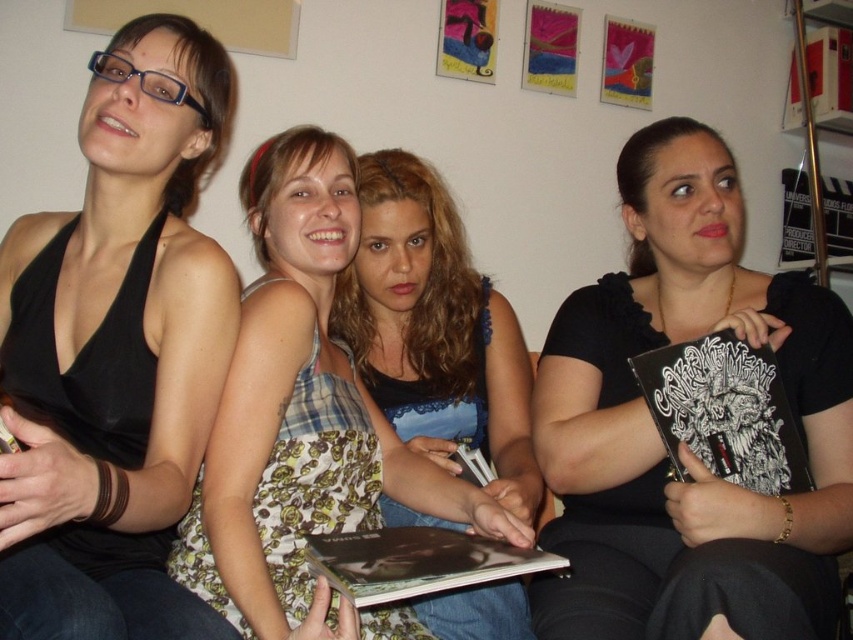
Question: Which of the following is the farthest from the observer?

Choices:
 (A) black matte book at center
 (B) plaid fabric dress at center
 (C) black matte tank top at left

Answer: (A)

Question: Considering the relative positions of black matte book at center and plaid fabric dress at center in the image provided, where is black matte book at center located with respect to plaid fabric dress at center?

Choices:
 (A) left
 (B) right

Answer: (B)

Question: Does black matte tank top at left have a greater width compared to plaid fabric dress at center?

Choices:
 (A) no
 (B) yes

Answer: (A)

Question: Can you confirm if black matte tank top at left is smaller than plaid fabric dress at center?

Choices:
 (A) no
 (B) yes

Answer: (B)

Question: Which point is closer to the camera?

Choices:
 (A) plaid fabric dress at center
 (B) black matte book at center
 (C) black matte tank top at left

Answer: (C)

Question: Which point is farther to the camera?

Choices:
 (A) (248, 371)
 (B) (126, 486)
 (C) (689, 593)

Answer: (A)